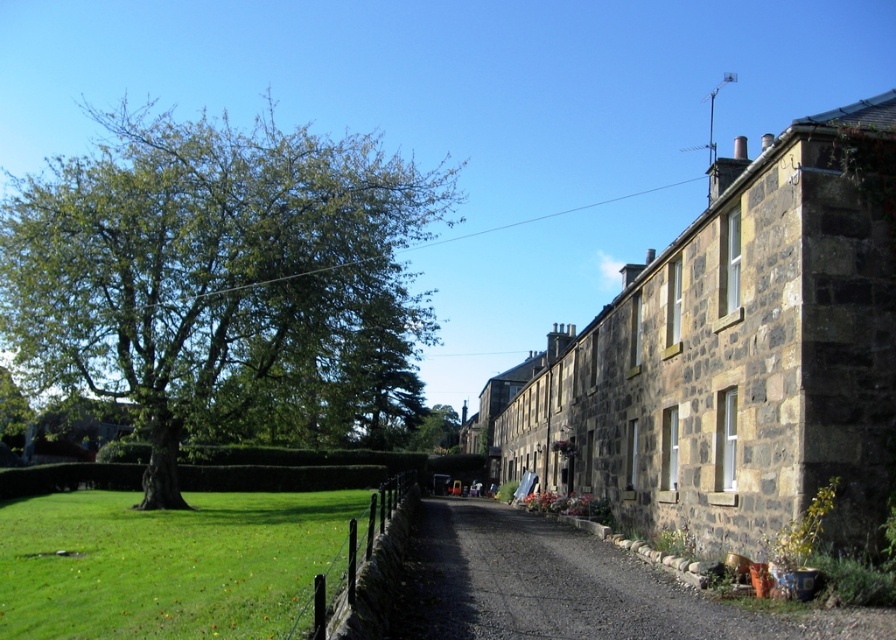
Question: Can you confirm if green leafy tree at left is thinner than green grass at lower left?

Choices:
 (A) yes
 (B) no

Answer: (B)

Question: Which object is positioned farthest from the green grass at lower left?

Choices:
 (A) gray gravel driveway at center
 (B) green leafy tree at left

Answer: (B)

Question: Does green leafy tree at left come in front of green grass at lower left?

Choices:
 (A) no
 (B) yes

Answer: (A)

Question: Can you confirm if green grass at lower left is wider than gray gravel driveway at center?

Choices:
 (A) yes
 (B) no

Answer: (A)

Question: Which point is farther to the camera?

Choices:
 (A) (464, 534)
 (B) (138, 225)

Answer: (B)

Question: Among these objects, which one is farthest from the camera?

Choices:
 (A) green grass at lower left
 (B) green leafy tree at left
 (C) gray gravel driveway at center

Answer: (B)